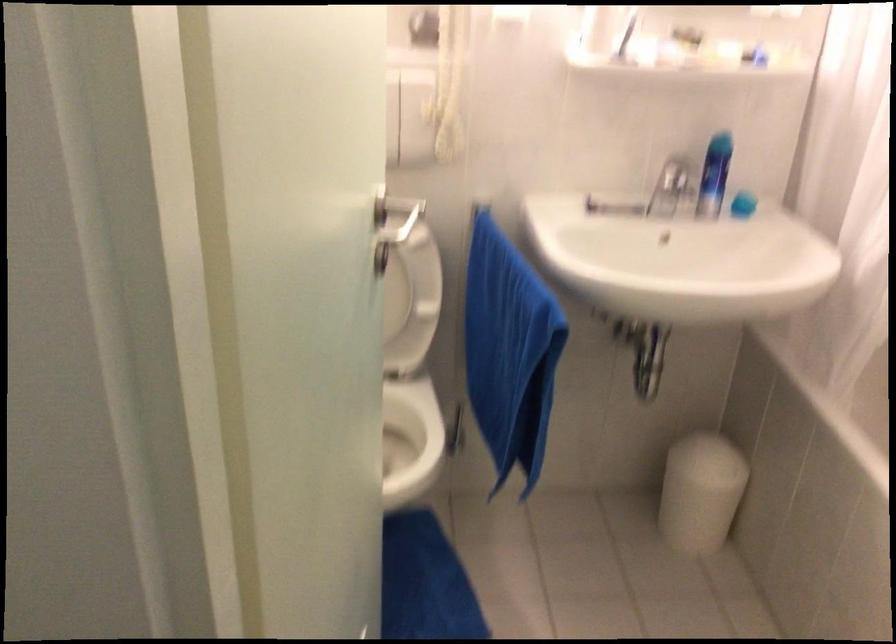
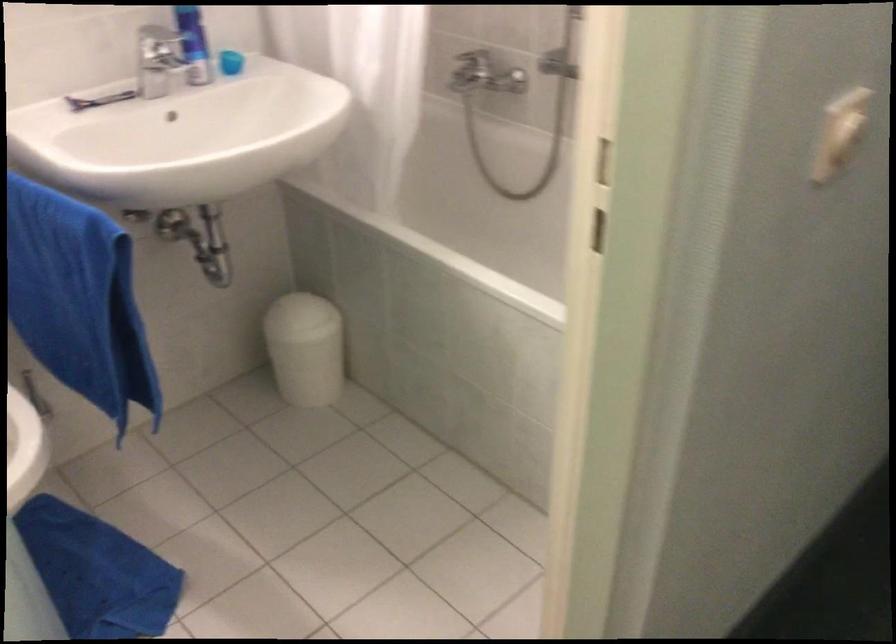
The point at (741, 201) is marked in the first image. Where is the corresponding point in the second image?

(230, 62)